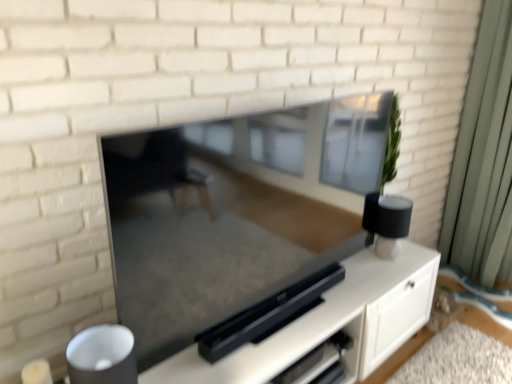
Locate an element on the screen. vacant space in matte black tv at center (from a real-world perspective) is located at coordinates (283, 323).